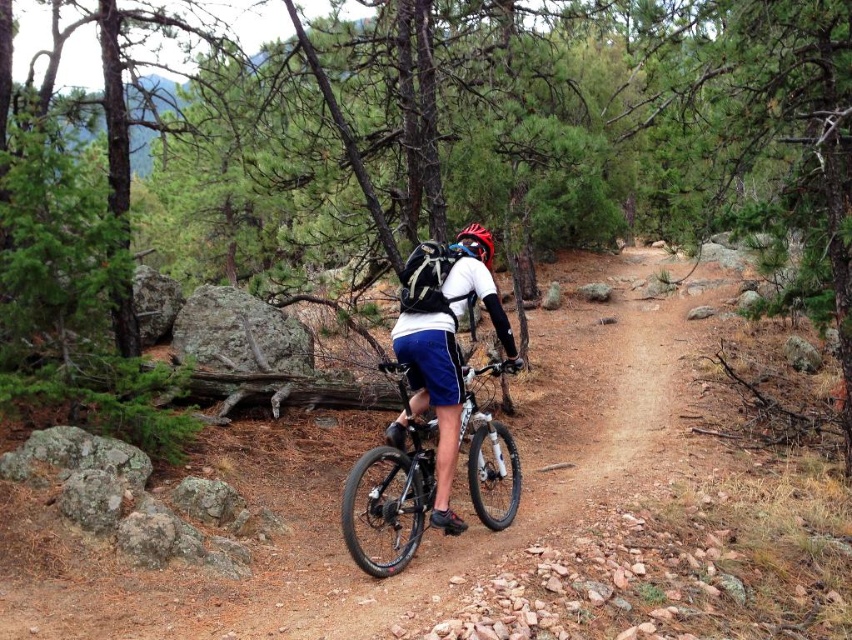
Question: Which object appears farthest from the camera in this image?

Choices:
 (A) shiny black frame at center
 (B) matte blue shorts at center
 (C) matte red bicycle helmet at center

Answer: (C)

Question: Considering the relative positions of shiny black frame at center and matte red bicycle helmet at center in the image provided, where is shiny black frame at center located with respect to matte red bicycle helmet at center?

Choices:
 (A) left
 (B) right

Answer: (A)

Question: Is matte blue shorts at center positioned behind matte red bicycle helmet at center?

Choices:
 (A) yes
 (B) no

Answer: (B)

Question: Is matte blue shorts at center smaller than matte red bicycle helmet at center?

Choices:
 (A) no
 (B) yes

Answer: (A)

Question: Which point is closer to the camera taking this photo?

Choices:
 (A) (479, 257)
 (B) (400, 563)
 (C) (427, 304)

Answer: (B)

Question: Among these points, which one is nearest to the camera?

Choices:
 (A) (430, 376)
 (B) (462, 244)

Answer: (A)